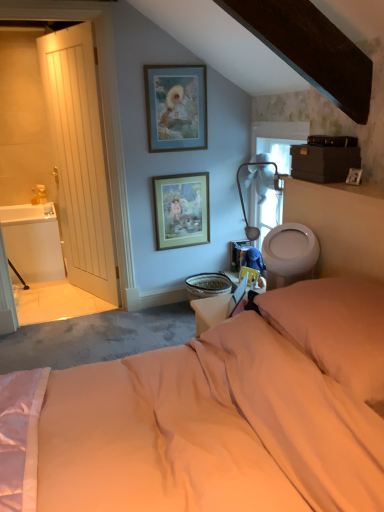
Question: Is white glossy sink at left facing away from white fabric lampshade at upper center?

Choices:
 (A) no
 (B) yes

Answer: (A)

Question: Considering the relative sizes of white glossy sink at left and white fabric lampshade at upper center in the image provided, is white glossy sink at left taller than white fabric lampshade at upper center?

Choices:
 (A) no
 (B) yes

Answer: (B)

Question: Does white glossy sink at left have a lesser height compared to white fabric lampshade at upper center?

Choices:
 (A) no
 (B) yes

Answer: (A)

Question: From the image's perspective, is white glossy sink at left above white fabric lampshade at upper center?

Choices:
 (A) yes
 (B) no

Answer: (B)

Question: Is white glossy sink at left to the right of white fabric lampshade at upper center from the viewer's perspective?

Choices:
 (A) yes
 (B) no

Answer: (B)

Question: Is wooden framed print at center, arranged as the first picture frame when ordered from the bottom, to the left or to the right of white wooden door at left in the image?

Choices:
 (A) left
 (B) right

Answer: (B)

Question: From a real-world perspective, relative to white wooden door at left, is wooden framed print at center, arranged as the first picture frame when ordered from the bottom, vertically above or below?

Choices:
 (A) below
 (B) above

Answer: (A)

Question: Is wooden framed print at center, the 2th picture frame when ordered from top to bottom, taller or shorter than white wooden door at left?

Choices:
 (A) tall
 (B) short

Answer: (B)

Question: Is wooden framed print at center, arranged as the first picture frame when ordered from the bottom, spatially inside white wooden door at left, or outside of it?

Choices:
 (A) inside
 (B) outside

Answer: (B)

Question: Relative to wooden framed print at center, the 2th picture frame when ordered from top to bottom, is white fabric lampshade at upper center in front or behind?

Choices:
 (A) front
 (B) behind

Answer: (A)

Question: From a real-world perspective, is white fabric lampshade at upper center positioned above or below wooden framed print at center, arranged as the first picture frame when ordered from the bottom?

Choices:
 (A) below
 (B) above

Answer: (B)

Question: Is white fabric lampshade at upper center bigger or smaller than wooden framed print at center, arranged as the first picture frame when ordered from the bottom?

Choices:
 (A) big
 (B) small

Answer: (A)

Question: Looking at their shapes, would you say white fabric lampshade at upper center is wider or thinner than wooden framed print at center, arranged as the first picture frame when ordered from the bottom?

Choices:
 (A) thin
 (B) wide

Answer: (B)

Question: From a real-world perspective, relative to white glossy toilet bowl at right, is blue matte picture frame at upper center, which is the 2th picture frame in bottom-to-top order, vertically above or below?

Choices:
 (A) below
 (B) above

Answer: (B)

Question: Considering the positions of blue matte picture frame at upper center, which ranks as the first picture frame in top-to-bottom order, and white glossy toilet bowl at right in the image, is blue matte picture frame at upper center, which ranks as the first picture frame in top-to-bottom order, wider or thinner than white glossy toilet bowl at right?

Choices:
 (A) wide
 (B) thin

Answer: (B)